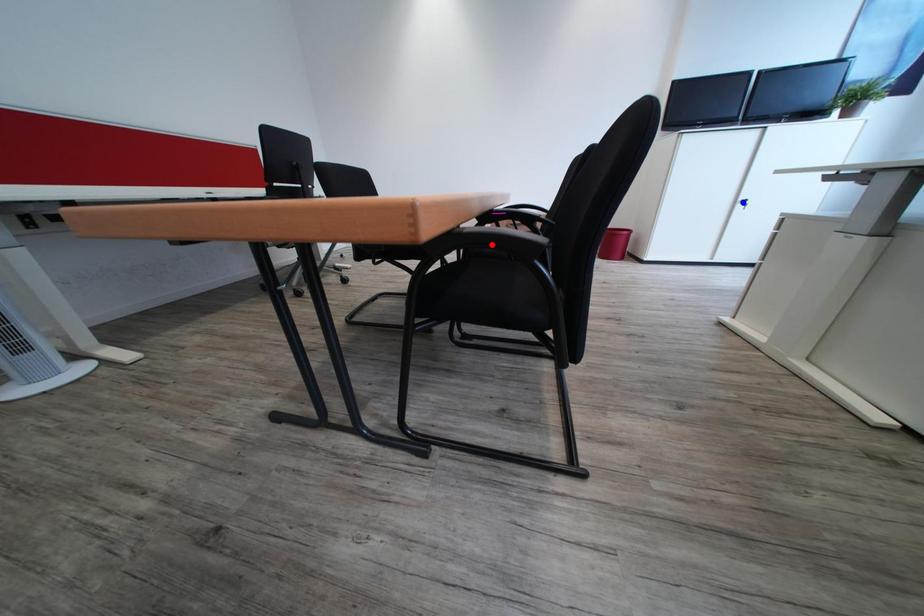
Question: Two points are marked on the image. Which point is closer to the camera?

Choices:
 (A) Blue point is closer.
 (B) Red point is closer.

Answer: (B)